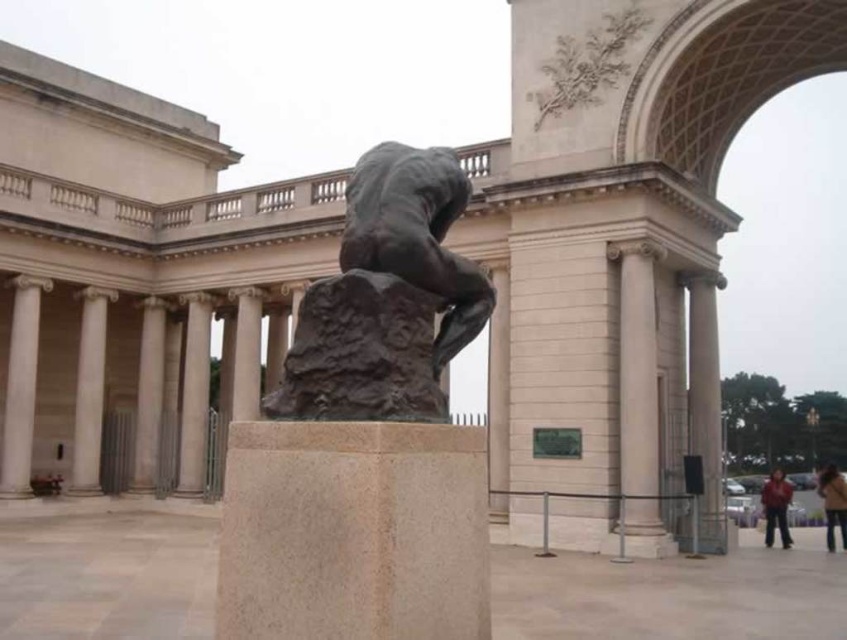
You are standing in front of the sculpture of The Thinker and want to take a photo. You notice two points marked in the scene. Which of the two points, point (418, 276) or point (148, 492), is closer to you?

Point (418, 276) is closer to the viewer than point (148, 492).

You are standing in front of the sculpture and want to take a photo that includes both the sculpture and the smooth gray column at center. Based on their positions, where should you position yourself to capture both in the frame?

To capture both the sculpture and the smooth gray column at center in the frame, position yourself such that the column is located at approximately the point 0.617 on the horizontal axis and 0.230 on the vertical axis relative to the image plane. This placement ensures both elements are within the camera view.

From the picture: You are an art student standing in front of the sculpture. You notice the smooth gray column at center and the brown leather jacket at lower right. Which object is positioned higher from the ground?

The smooth gray column at center is located above the brown leather jacket at lower right, so it is positioned higher from the ground.